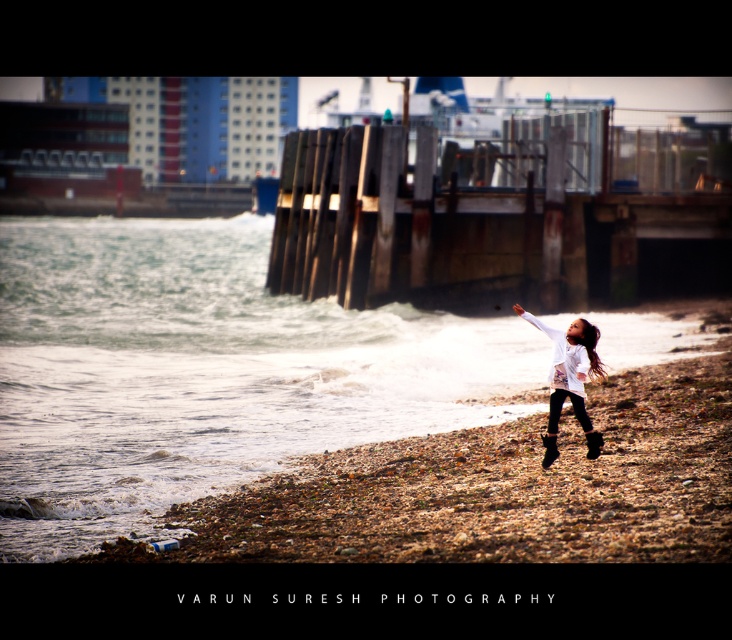
Is point (299, 170) positioned after point (578, 349)?

Yes, point (299, 170) is behind point (578, 349).

Which is in front, point (438, 259) or point (593, 333)?

Point (593, 333)

From the picture: Who is more forward, (687, 145) or (572, 353)?

Point (572, 353) is more forward.

Find the location of `rusty wood dock at center`. rusty wood dock at center is located at coordinates (493, 218).